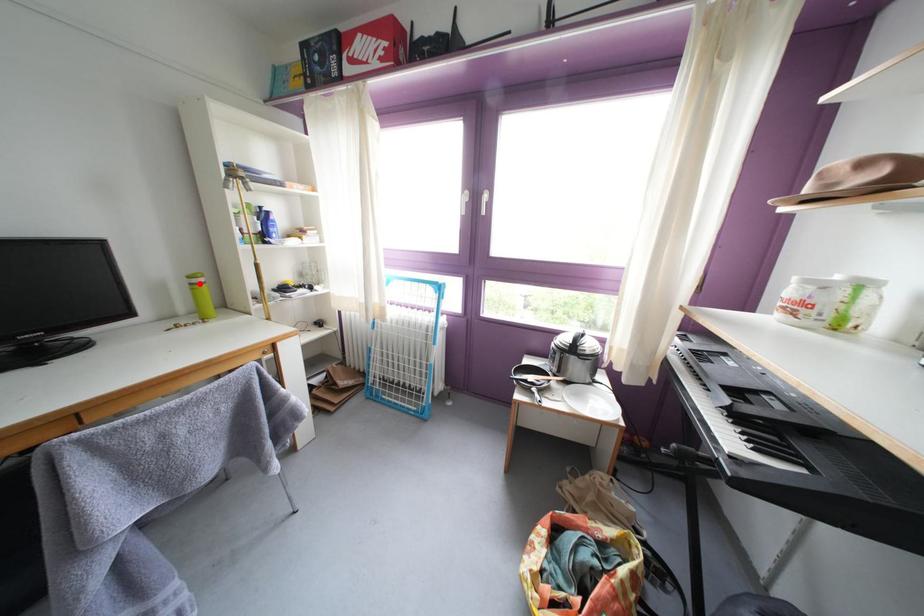
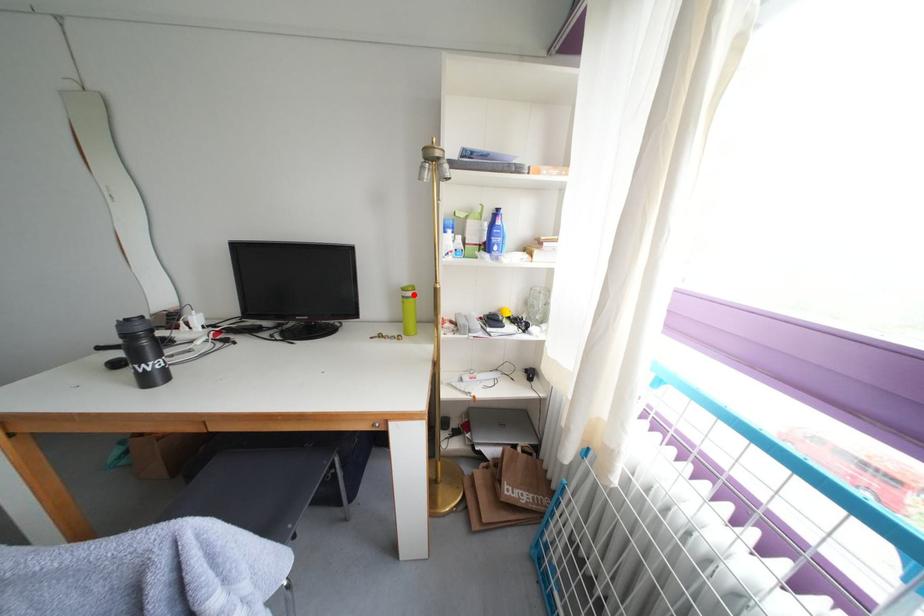
I am providing you with two images of the same scene from different viewpoints. A red point is marked on the first image and another point is marked on the second image. Is the marked point in image1 the same physical position as the marked point in image2?

Yes